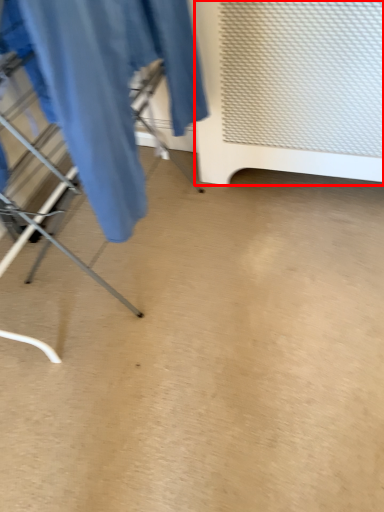
Question: From the image, what is the correct spatial relationship of furniture (annotated by the red box) in relation to clothing?

Choices:
 (A) left
 (B) right

Answer: (B)